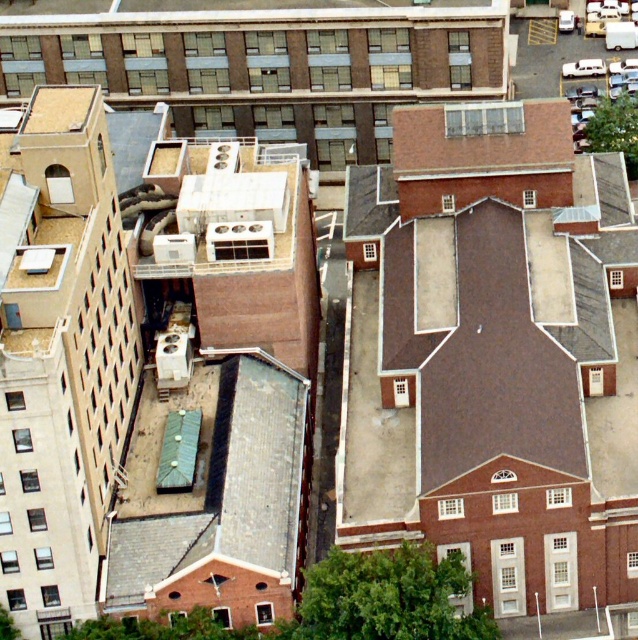
Question: Is smooth concrete roof at upper center below brown textured roof at upper center?

Choices:
 (A) no
 (B) yes

Answer: (A)

Question: Observing the image, what is the correct spatial positioning of smooth concrete roof at upper center in reference to brown textured roof at upper center?

Choices:
 (A) below
 (B) above

Answer: (B)

Question: Which point is closer to the camera taking this photo?

Choices:
 (A) (403, 113)
 (B) (380, 10)

Answer: (A)

Question: Can you confirm if smooth concrete roof at upper center is positioned to the left of brown textured roof at upper center?

Choices:
 (A) yes
 (B) no

Answer: (A)